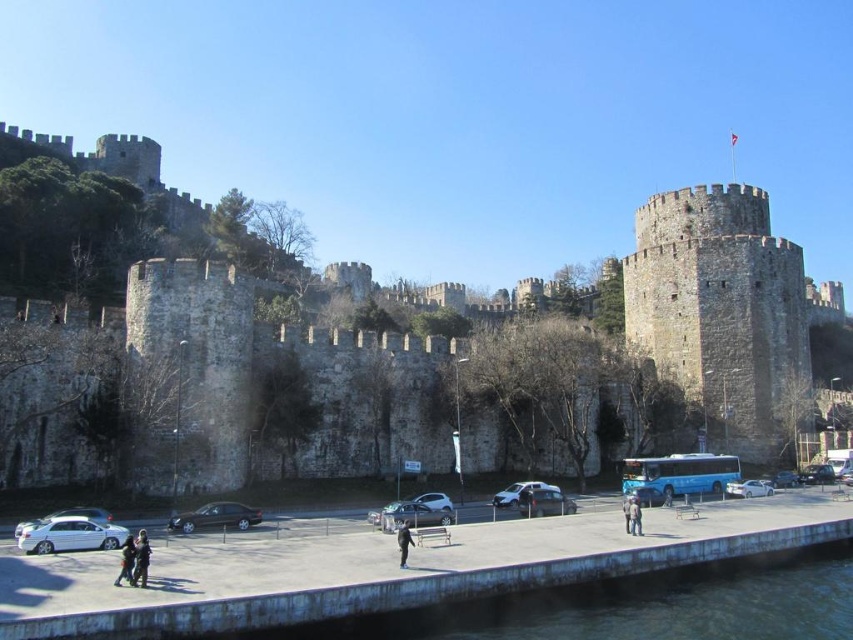
Question: Estimate the real-world distances between objects in this image. Which object is closer to the dark gray jacket at lower center?

Choices:
 (A) silver metallic car at center
 (B) stone wall at center
 (C) shiny silver sedan at center

Answer: (A)

Question: Which point is farther to the camera?

Choices:
 (A) white matte car at lower center
 (B) black leather jacket at lower center

Answer: (A)

Question: Is white matte car at lower left smaller than metallic silver sedan at lower right?

Choices:
 (A) no
 (B) yes

Answer: (B)

Question: Can you confirm if metallic silver car at lower center is positioned to the right of black leather jacket at lower center?

Choices:
 (A) yes
 (B) no

Answer: (A)

Question: Does matte black car at center have a smaller size compared to dark blue jeans at lower center?

Choices:
 (A) no
 (B) yes

Answer: (A)

Question: Which object is positioned farthest from the shiny silver sedan at center?

Choices:
 (A) dark gray jacket at lower center
 (B) shiny black sedan at lower right
 (C) black fabric jacket at lower center
 (D) dark blue jeans at lower center

Answer: (A)